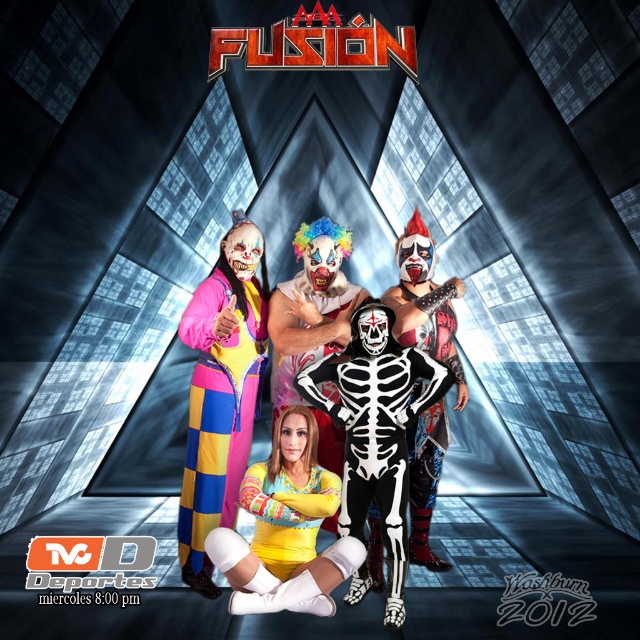
Question: Which point is farther from the camera taking this photo?

Choices:
 (A) (384, 371)
 (B) (422, 371)

Answer: (B)

Question: Which point is farther to the camera?

Choices:
 (A) white skeleton costume at center
 (B) multicolored fabric clown suit at center
 (C) yellow spandex at center

Answer: (A)

Question: Which is farther from the matte black skeleton suit at center?

Choices:
 (A) yellow spandex bodysuit at center
 (B) white skeleton costume at center
 (C) black and white skeleton suit at center

Answer: (B)

Question: Is white skeleton costume at center above yellow spandex bodysuit at center?

Choices:
 (A) yes
 (B) no

Answer: (A)

Question: Is black and white skeleton suit at center to the right of yellow spandex bodysuit at center from the viewer's perspective?

Choices:
 (A) no
 (B) yes

Answer: (B)

Question: Does matte black skeleton suit at center appear on the right side of yellow spandex at center?

Choices:
 (A) yes
 (B) no

Answer: (A)